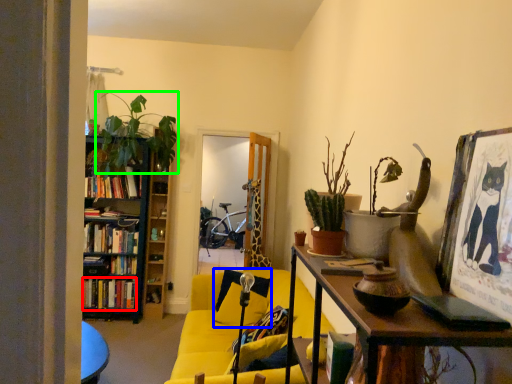
Question: Which object is the farthest from book (highlighted by a red box)? Choose among these: pillow (highlighted by a blue box) or houseplant (highlighted by a green box).

Choices:
 (A) pillow
 (B) houseplant

Answer: (A)